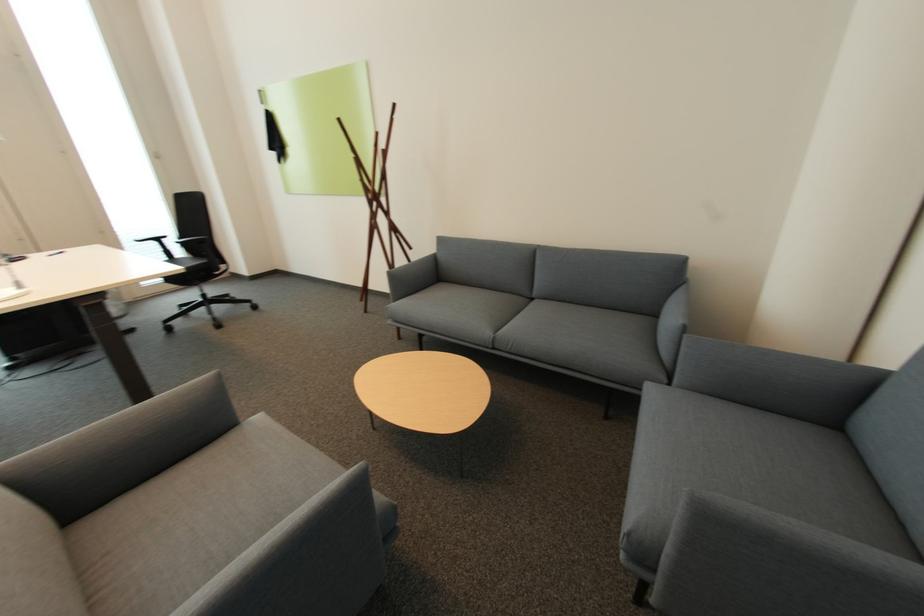
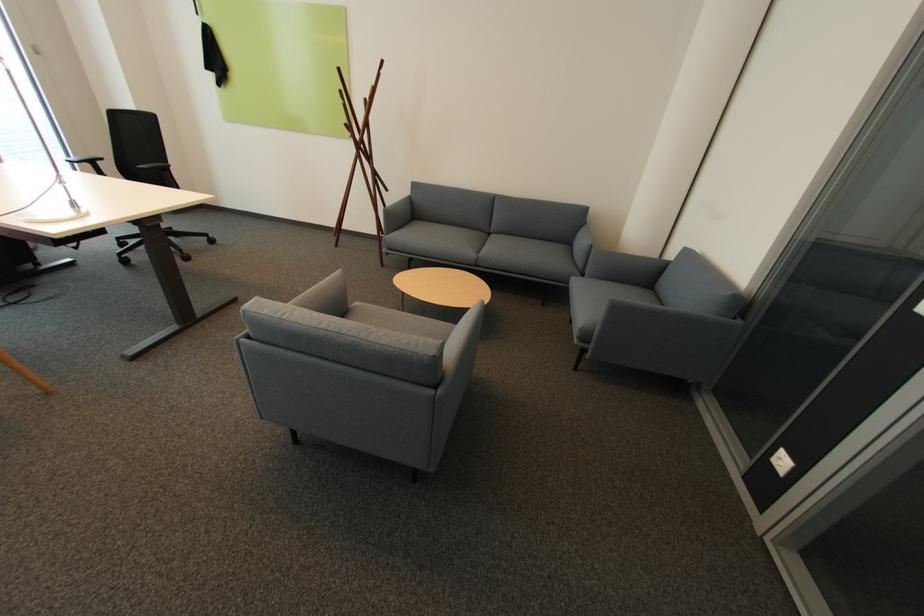
In the second image, find the point that corresponds to point 669,383 in the first image.

(585, 277)